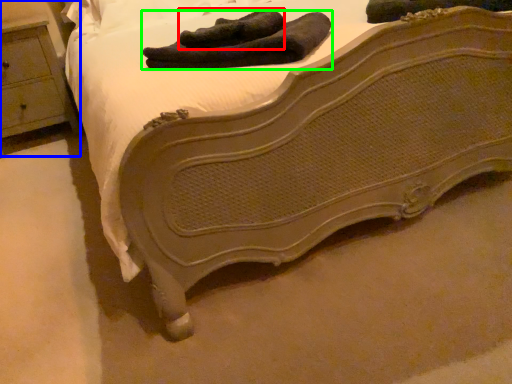
Question: Which is nearer to the footwear (highlighted by a red box)? nightstand (highlighted by a blue box) or footwear (highlighted by a green box).

Choices:
 (A) nightstand
 (B) footwear

Answer: (B)